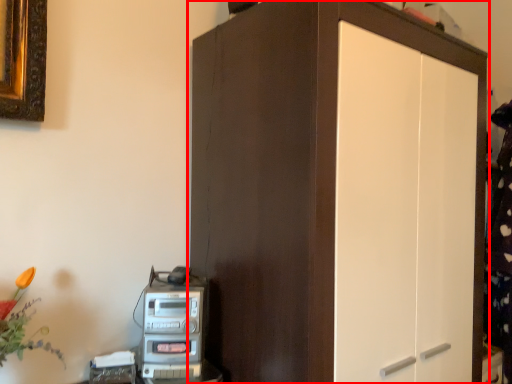
Question: Observing the image, what is the correct spatial positioning of cupboard (annotated by the red box) in reference to home appliance?

Choices:
 (A) left
 (B) right

Answer: (B)